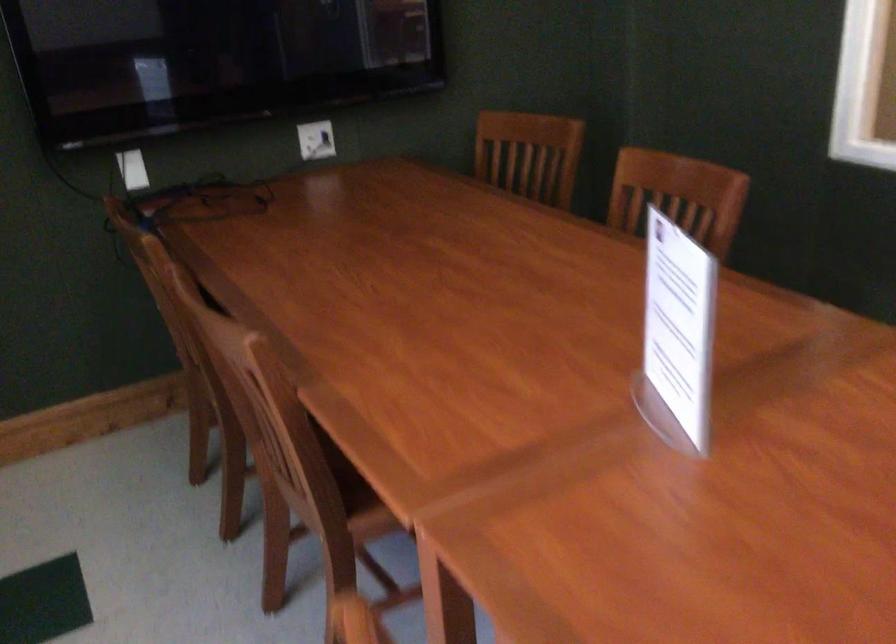
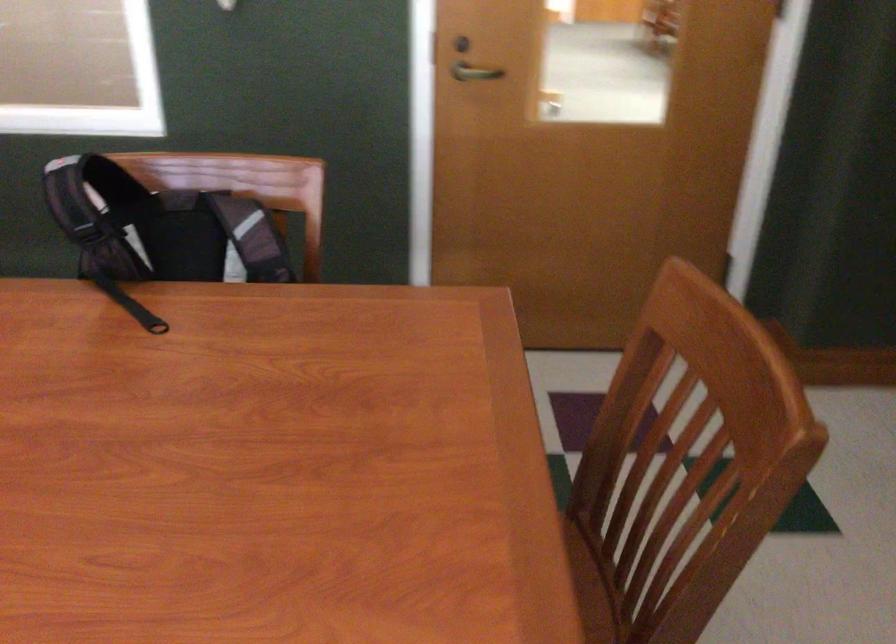
Question: The first image is from the beginning of the video and the second image is from the end. How did the camera likely rotate when shooting the video?

Choices:
 (A) Left
 (B) Right
 (C) Up
 (D) Down

Answer: (B)